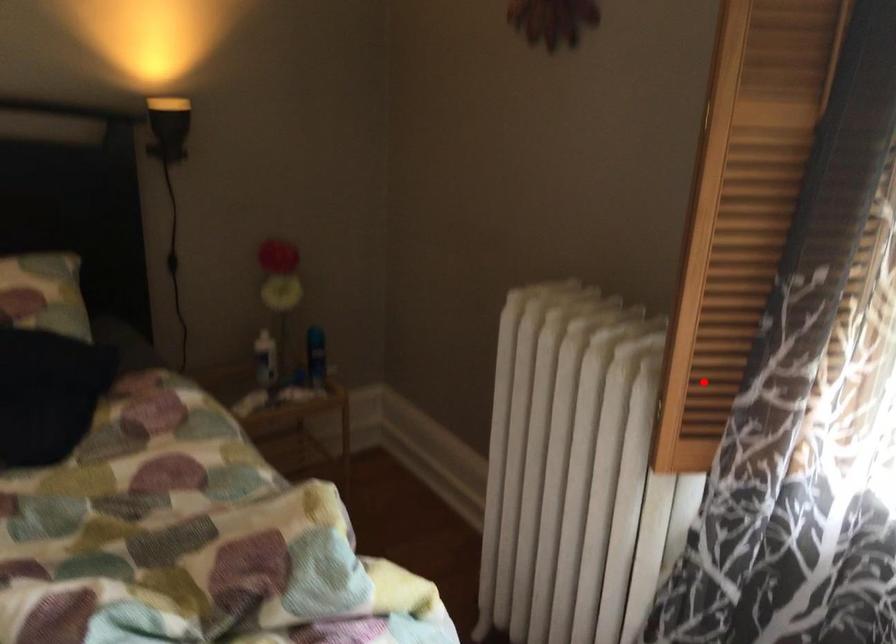
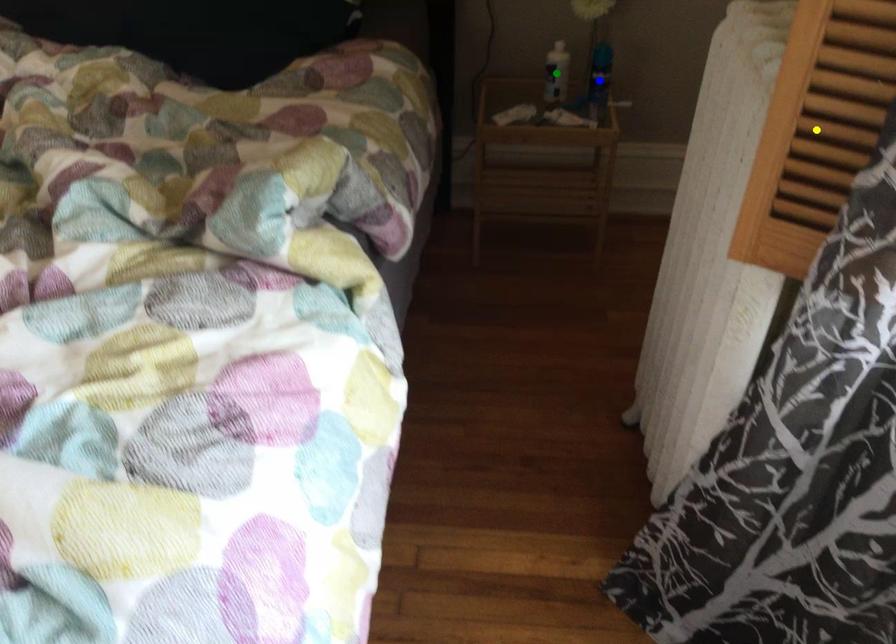
Question: I am providing you with two images of the same scene from different viewpoints. A red point is marked on the first image. You are given multiple points on the second image. Which point in image 2 is actually the same real-world point as the red point in image 1?

Choices:
 (A) yellow point
 (B) blue point
 (C) green point

Answer: (A)